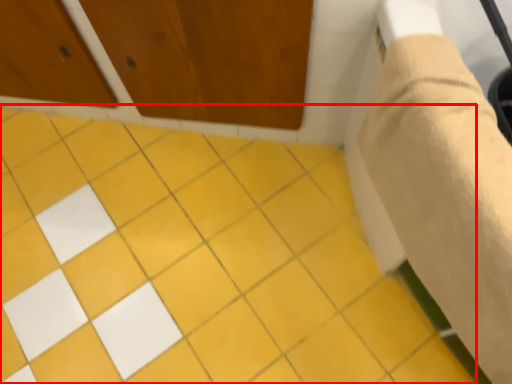
Question: From the image's perspective, what is the correct spatial relationship of ceramic tile (annotated by the red box) in relation to plaster bandage?

Choices:
 (A) below
 (B) above

Answer: (A)